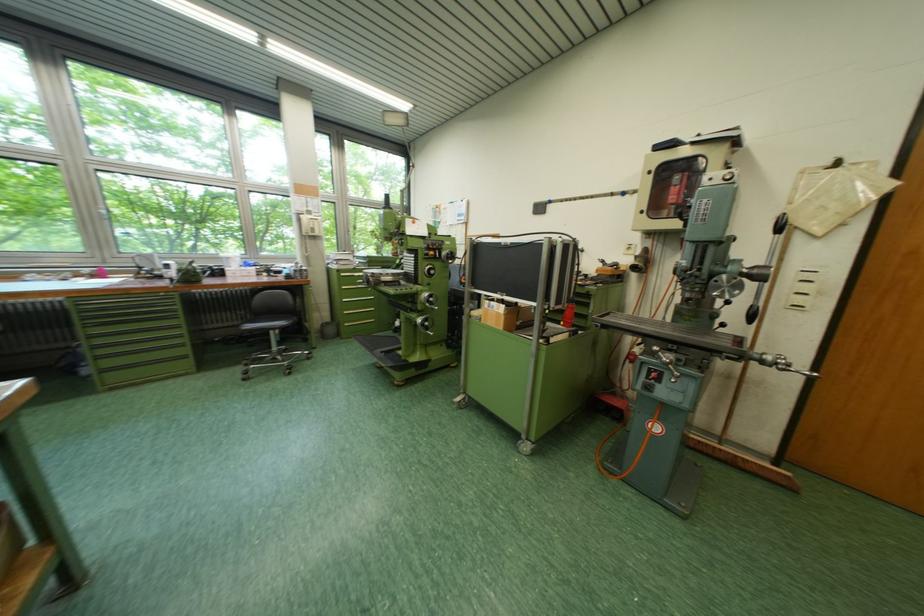
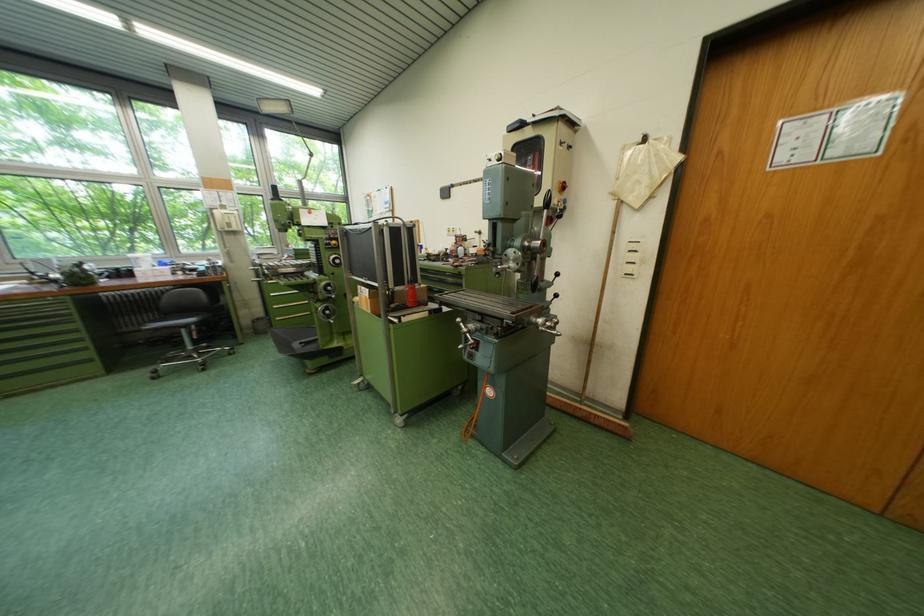
Question: The first image is from the beginning of the video and the second image is from the end. How did the camera likely rotate when shooting the video?

Choices:
 (A) Left
 (B) Right
 (C) Up
 (D) Down

Answer: (D)